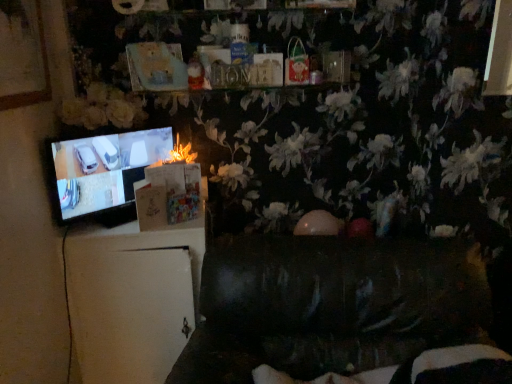
Locate an element on the screen. dark leather couch at lower center is located at coordinates (331, 306).

What is the approximate height of dark leather couch at lower center?

The height of dark leather couch at lower center is 35.48 inches.

What is the approximate width of fluffy paper at center?

The width of fluffy paper at center is 4.54 inches.

You are a GUI agent. You are given a task and a screenshot of the screen. Output one action in this format:
    pyautogui.click(x=<x>, y=<y>)
    Task: Click on the black glossy television at left
    
    Given the screenshot: What is the action you would take?
    pyautogui.click(x=102, y=170)

The width and height of the screenshot is (512, 384). In order to click on dark leather couch at lower center in this screenshot , I will do `click(331, 306)`.

Does black glossy television at left touch fluffy paper at center?

There is a gap between black glossy television at left and fluffy paper at center.

Relative to fluffy paper at center, is black glossy television at left in front or behind?

black glossy television at left is in front of fluffy paper at center.

In the image, is black glossy television at left on the left side or the right side of fluffy paper at center?

Clearly, black glossy television at left is on the left of fluffy paper at center in the image.

Where is `furniture to the right of fluffy paper at center`? furniture to the right of fluffy paper at center is located at coordinates point(331,306).

Considering the sizes of objects dark leather couch at lower center and fluffy paper at center in the image provided, who is taller, dark leather couch at lower center or fluffy paper at center?

Standing taller between the two is dark leather couch at lower center.

Between dark leather couch at lower center and fluffy paper at center, which one is positioned in front?

dark leather couch at lower center is closer to the camera.

Is the surface of dark leather couch at lower center in direct contact with fluffy paper at center?

No.

Does dark leather couch at lower center touch black glossy television at left?

dark leather couch at lower center and black glossy television at left are clearly separated.

Is dark leather couch at lower center aimed at black glossy television at left?

No, dark leather couch at lower center is not oriented towards black glossy television at left.

How many degrees apart are the facing directions of dark leather couch at lower center and black glossy television at left?

The facing directions of dark leather couch at lower center and black glossy television at left are 48.5 degrees apart.

Looking at this image, which of these two, dark leather couch at lower center or black glossy television at left, is thinner?

black glossy television at left is thinner.

Which object is thinner, fluffy paper at center or dark leather couch at lower center?

fluffy paper at center is thinner.

Which object is positioned more to the right, fluffy paper at center or dark leather couch at lower center?

dark leather couch at lower center is more to the right.

Where is `furniture below the fluffy paper at center (from a real-world perspective)`? furniture below the fluffy paper at center (from a real-world perspective) is located at coordinates (331, 306).

From a real-world perspective, is fluffy paper at center positioned under black glossy television at left based on gravity?

No, from a real-world perspective, fluffy paper at center is not beneath black glossy television at left.

Does fluffy paper at center have a greater width compared to black glossy television at left?

Indeed, fluffy paper at center has a greater width compared to black glossy television at left.

Considering the points (183, 145) and (127, 161), which point is in front, point (183, 145) or point (127, 161)?

The point (127, 161) is more forward.

In order to click on television on the left of the dark leather couch at lower center in this screenshot , I will do `click(102, 170)`.

From a real-world perspective, who is located higher, black glossy television at left or dark leather couch at lower center?

black glossy television at left.

Is black glossy television at left placed right next to dark leather couch at lower center?

No, black glossy television at left is not making contact with dark leather couch at lower center.

The width and height of the screenshot is (512, 384). Identify the location of television that appears below the fluffy paper at center (from the image's perspective). [102, 170].

Locate an element on the screen. Image resolution: width=512 pixels, height=384 pixels. furniture that appears in front of the fluffy paper at center is located at coordinates (331, 306).

Based on the photo, from the image, which object appears to be nearer to dark leather couch at lower center, black glossy television at left or fluffy paper at center?

black glossy television at left is positioned closer to the anchor dark leather couch at lower center.

From the picture: Which object lies nearer to the anchor point dark leather couch at lower center, fluffy paper at center or black glossy television at left?

black glossy television at left lies closer to dark leather couch at lower center than the other object.

Considering their positions, is fluffy paper at center positioned closer to black glossy television at left than dark leather couch at lower center?

Among the two, fluffy paper at center is located nearer to black glossy television at left.

From the image, which object appears to be farther from fluffy paper at center, dark leather couch at lower center or black glossy television at left?

dark leather couch at lower center is further to fluffy paper at center.

Considering their positions, is dark leather couch at lower center positioned further to black glossy television at left than fluffy paper at center?

The object further to black glossy television at left is dark leather couch at lower center.

Estimate the real-world distances between objects in this image. Which object is closer to fluffy paper at center, black glossy television at left or dark leather couch at lower center?

Based on the image, black glossy television at left appears to be nearer to fluffy paper at center.

You are a GUI agent. You are given a task and a screenshot of the screen. Output one action in this format:
    pyautogui.click(x=<x>, y=<y>)
    Task: Click on the television between dark leather couch at lower center and fluffy paper at center from front to back
    The width and height of the screenshot is (512, 384).
    Given the screenshot: What is the action you would take?
    pyautogui.click(x=102, y=170)